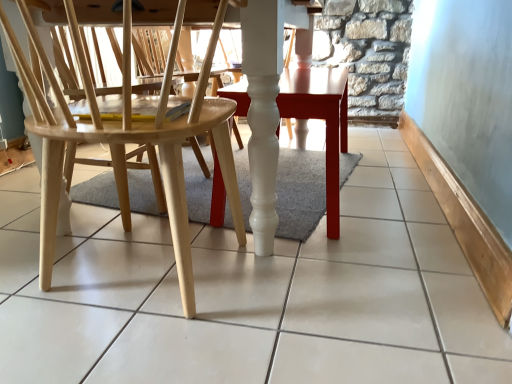
Question: Considering their positions, is white glossy table at center located in front of or behind natural wood chair at left?

Choices:
 (A) front
 (B) behind

Answer: (B)

Question: From their relative heights in the image, would you say white glossy table at center is taller or shorter than natural wood chair at left?

Choices:
 (A) tall
 (B) short

Answer: (B)

Question: From the image's perspective, is white glossy table at center located above or below natural wood chair at left?

Choices:
 (A) below
 (B) above

Answer: (B)

Question: Considering the positions of natural wood chair at left and white glossy table at center in the image, is natural wood chair at left taller or shorter than white glossy table at center?

Choices:
 (A) tall
 (B) short

Answer: (A)

Question: In terms of size, does natural wood chair at left appear bigger or smaller than white glossy table at center?

Choices:
 (A) big
 (B) small

Answer: (A)

Question: Which is correct: natural wood chair at left is inside white glossy table at center, or outside of it?

Choices:
 (A) inside
 (B) outside

Answer: (B)

Question: From the image's perspective, relative to white glossy table at center, is natural wood chair at left above or below?

Choices:
 (A) above
 (B) below

Answer: (B)